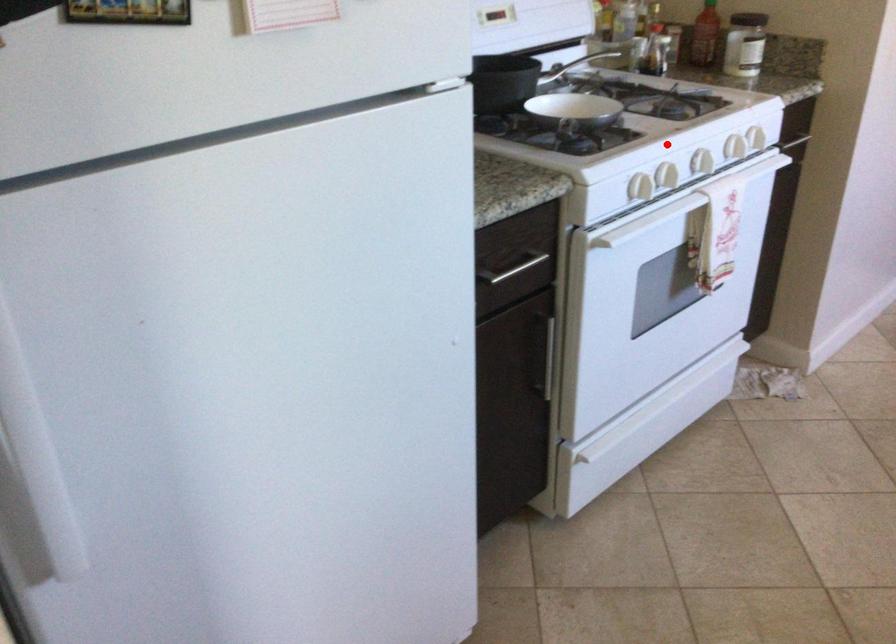
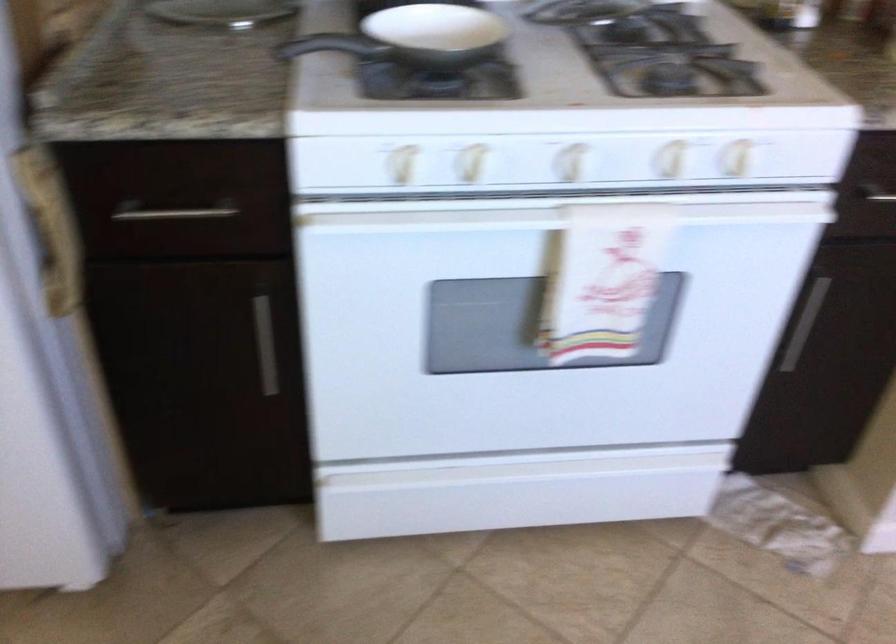
Where in the second image is the point corresponding to the highlighted location from the first image?

(471, 163)